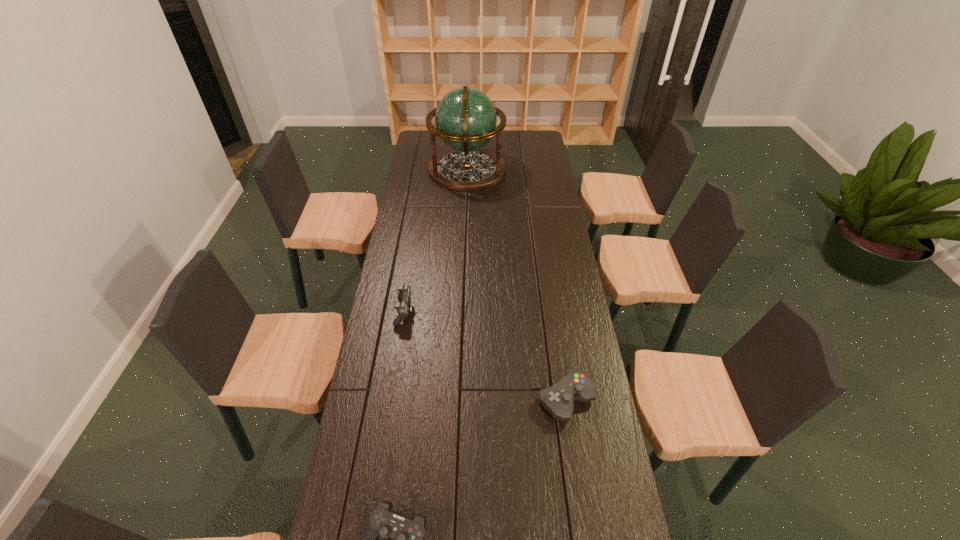
The width and height of the screenshot is (960, 540). Identify the location of free space between the second nearest object and the third nearest object. (486, 355).

This screenshot has height=540, width=960. Find the location of `unoccupied area between the second nearest control and the globe`. unoccupied area between the second nearest control and the globe is located at coordinates (516, 284).

The image size is (960, 540). I want to click on blank region between the tallest control and the second nearest control, so click(486, 355).

The width and height of the screenshot is (960, 540). Identify the location of free area in between the farthest object and the second farthest object. (436, 241).

In order to click on the second closest object to the nearest object in this screenshot , I will do `click(404, 295)`.

You are a GUI agent. You are given a task and a screenshot of the screen. Output one action in this format:
    pyautogui.click(x=<x>, y=<y>)
    Task: Click on the object that is the second closest to the rightmost object
    
    Given the screenshot: What is the action you would take?
    pyautogui.click(x=404, y=295)

Where is `control that is the second closest to the rightmost control`? This screenshot has height=540, width=960. control that is the second closest to the rightmost control is located at coordinates (404, 295).

Point out which control is positioned as the nearest to the globe. Please provide its 2D coordinates. Your answer should be formatted as a tuple, i.e. [(x, y)], where the tuple contains the x and y coordinates of a point satisfying the conditions above.

[(404, 295)]

Image resolution: width=960 pixels, height=540 pixels. What are the coordinates of `vacant space that satisfies the following two spatial constraints: 1. on the surface of the second tallest object with buttons; 2. on the left side of the third farthest object` in the screenshot? It's located at (391, 399).

Find the location of a particular element. The image size is (960, 540). vacant region that satisfies the following two spatial constraints: 1. on the back side of the rightmost object; 2. on the front-facing side of the farthest object is located at coordinates (531, 170).